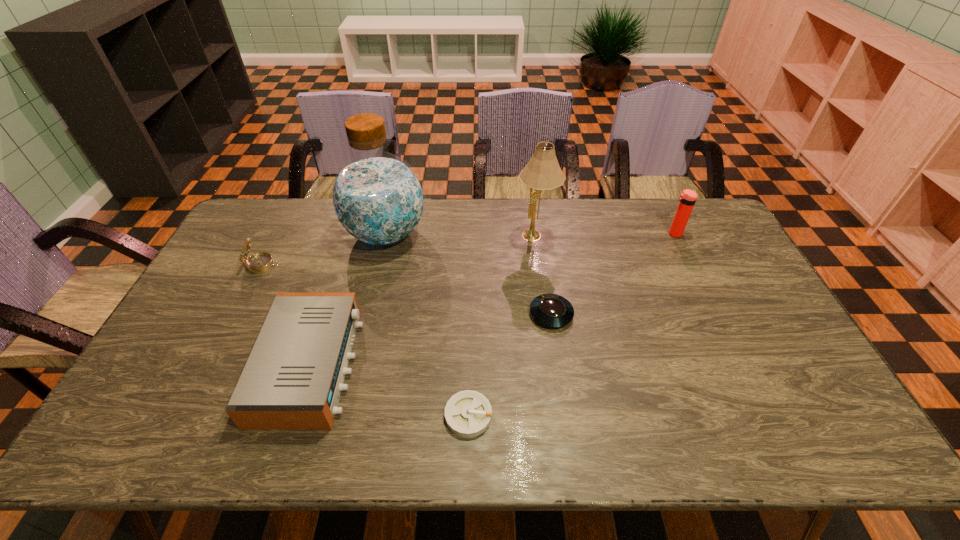
The height and width of the screenshot is (540, 960). Identify the location of free point that satisfies the following two spatial constraints: 1. on the back side of the rightmost object; 2. on the left side of the second shortest object. (540, 234).

You are a GUI agent. You are given a task and a screenshot of the screen. Output one action in this format:
    pyautogui.click(x=<x>, y=<y>)
    Task: Click on the free space that satisfies the following two spatial constraints: 1. on the control panel of the ashtray; 2. on the left side of the third shortest object
    Image resolution: width=960 pixels, height=540 pixels.
    Given the screenshot: What is the action you would take?
    pyautogui.click(x=295, y=415)

Where is `vacant space that satisfies the following two spatial constraints: 1. with the dial facing the fourth shortest object; 2. on the left side of the fourth object from left to right`? vacant space that satisfies the following two spatial constraints: 1. with the dial facing the fourth shortest object; 2. on the left side of the fourth object from left to right is located at coordinates (186, 415).